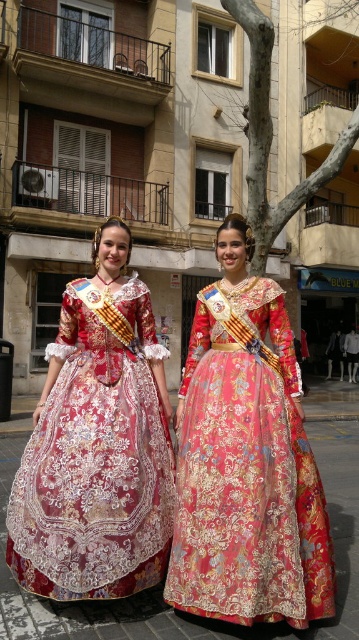
Which is more to the left, embroidered silk dress at center or shiny silk dress at center?

shiny silk dress at center is more to the left.

Is point (227, 301) positioned behind point (131, 307)?

No, (227, 301) is in front of (131, 307).

Identify the location of embroidered silk dress at center. (246, 470).